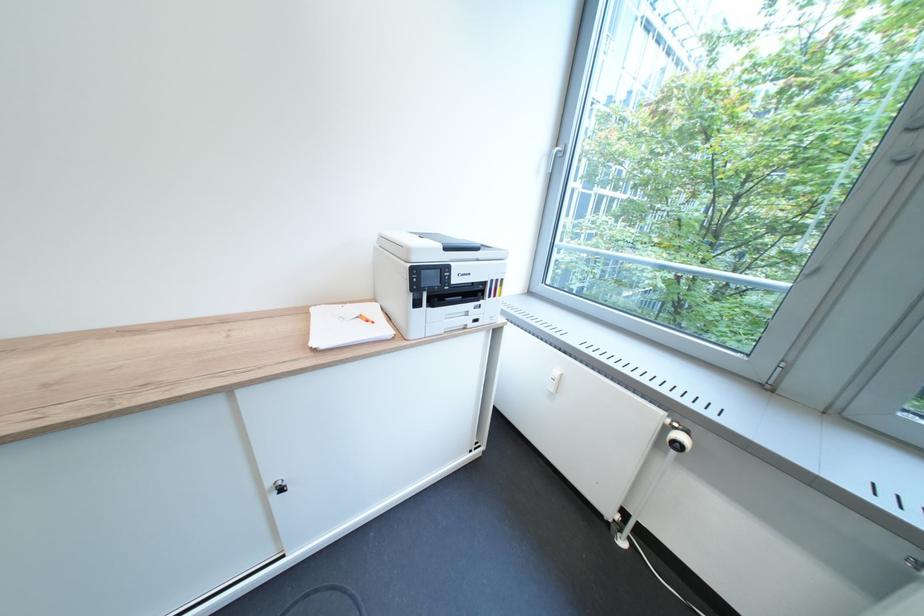
Locate an element on the screen. This screenshot has height=616, width=924. radiator thermostat knob is located at coordinates (678, 438).